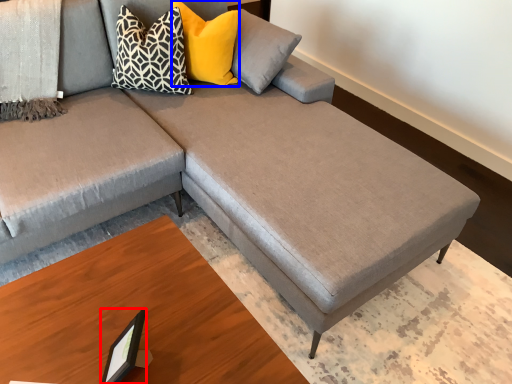
Question: Which object appears farthest to the camera in this image, picture frame (highlighted by a red box) or pillow (highlighted by a blue box)?

Choices:
 (A) picture frame
 (B) pillow

Answer: (B)